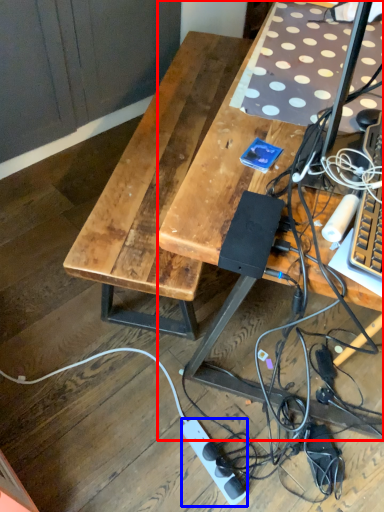
Question: Which of the following is the farthest to the observer, desk (highlighted by a red box) or power outlet (highlighted by a blue box)?

Choices:
 (A) desk
 (B) power outlet

Answer: (B)